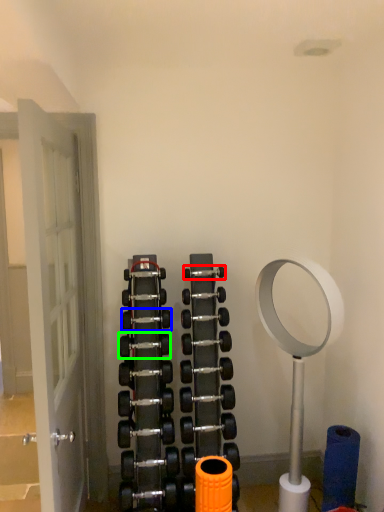
Question: Which is nearer to the dumbbell (highlighted by a red box)? dumbbell (highlighted by a blue box) or dumbbell (highlighted by a green box).

Choices:
 (A) dumbbell
 (B) dumbbell

Answer: (A)